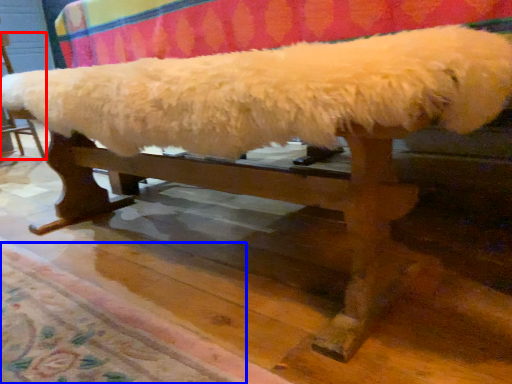
Question: Which object appears closest to the camera in this image, furniture (highlighted by a red box) or mat (highlighted by a blue box)?

Choices:
 (A) furniture
 (B) mat

Answer: (B)